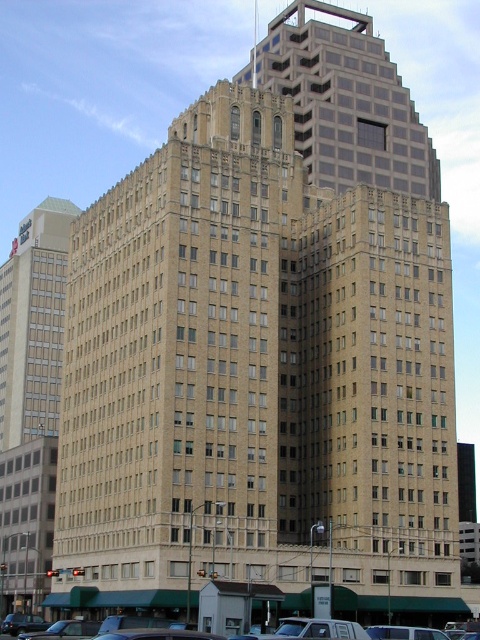
Is brown brick building at upper center above beige brick building at left?

Correct, brown brick building at upper center is located above beige brick building at left.

Does point (290, 92) come farther from viewer compared to point (3, 378)?

No, (290, 92) is closer to viewer.

Is point (405, 156) closer to viewer compared to point (11, 252)?

That is True.

Image resolution: width=480 pixels, height=640 pixels. I want to click on brown brick building at upper center, so click(345, 100).

Who is taller, brown brick building at upper center or silver metallic sedan at center?

Standing taller between the two is brown brick building at upper center.

Can you confirm if brown brick building at upper center is positioned above silver metallic sedan at center?

Correct, brown brick building at upper center is located above silver metallic sedan at center.

Describe the element at coordinates (345, 100) in the screenshot. I see `brown brick building at upper center` at that location.

Find the location of a particular element. Image resolution: width=480 pixels, height=640 pixels. brown brick building at upper center is located at coordinates (345, 100).

Between beige brick building at left and silver metallic sedan at center, which one appears on the left side from the viewer's perspective?

beige brick building at left is more to the left.

Who is taller, beige brick building at left or silver metallic sedan at center?

beige brick building at left

The height and width of the screenshot is (640, 480). In order to click on beige brick building at left in this screenshot , I will do `click(34, 323)`.